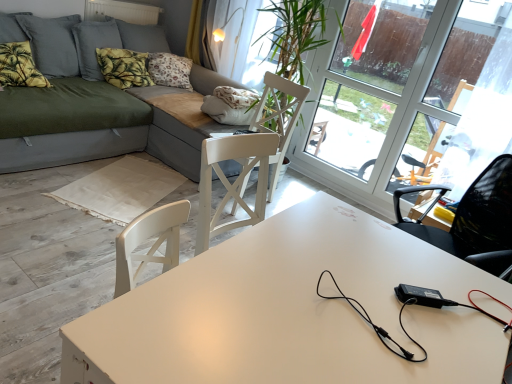
Measure the distance between yellow-green fabric pillow at upper left, the 1th pillow from the left, and camera.

yellow-green fabric pillow at upper left, the 1th pillow from the left, is 9.35 feet from camera.

Describe the element at coordinates (278, 118) in the screenshot. I see `white wood swivel chair at center` at that location.

Describe the element at coordinates (293, 311) in the screenshot. I see `white matte table at center` at that location.

The height and width of the screenshot is (384, 512). What do you see at coordinates (201, 34) in the screenshot?
I see `yellow fabric curtain at upper center` at bounding box center [201, 34].

Image resolution: width=512 pixels, height=384 pixels. Identify the location of yellow-green fabric pillow at upper left, the 1th pillow from the left. (19, 66).

Which object is further away from the camera, white wood swivel chair at center or white matte table at center?

white wood swivel chair at center is further away from the camera.

Does white wood swivel chair at center have a lesser height compared to white matte table at center?

No.

Based on the photo, is white wood swivel chair at center facing away from white matte table at center?

No, white wood swivel chair at center's orientation is not away from white matte table at center.

What's the angular difference between white wood swivel chair at center and white matte table at center's facing directions?

The angle between the facing direction of white wood swivel chair at center and the facing direction of white matte table at center is 82 degrees.

In the scene shown: Who is smaller, green leafy fabric pillow at upper left, placed as the first pillow when sorted from back to front, or matte gray couch at center?

green leafy fabric pillow at upper left, placed as the first pillow when sorted from back to front.

From a real-world perspective, is green leafy fabric pillow at upper left, placed as the first pillow when sorted from back to front, over matte gray couch at center?

Correct, in the physical world, green leafy fabric pillow at upper left, placed as the first pillow when sorted from back to front, is higher than matte gray couch at center.

How different are the orientations of green leafy fabric pillow at upper left, acting as the second pillow starting from the front, and matte gray couch at center in degrees?

The angle between the facing direction of green leafy fabric pillow at upper left, acting as the second pillow starting from the front, and the facing direction of matte gray couch at center is 4.48 degrees.

Is green leafy fabric pillow at upper left, the first pillow when ordered from right to left, not close to matte gray couch at center?

No, green leafy fabric pillow at upper left, the first pillow when ordered from right to left, is not far from matte gray couch at center.

From the image's perspective, between white matte table at center and yellow-green fabric pillow at upper left, which is counted as the 1th pillow, starting from the front, who is located below?

white matte table at center, from the image's perspective.

Is white matte table at center looking in the opposite direction of yellow-green fabric pillow at upper left, which is counted as the 1th pillow, starting from the front?

No, white matte table at center is not facing the opposite direction of yellow-green fabric pillow at upper left, which is counted as the 1th pillow, starting from the front.

From a real-world perspective, who is located lower, white matte table at center or yellow-green fabric pillow at upper left, the 1th pillow from the left?

In real-world perspective, white matte table at center is lower.

Which of these two, white matte table at center or yellow-green fabric pillow at upper left, positioned as the 2th pillow in right-to-left order, is bigger?

white matte table at center.

Is matte gray couch at center to the left or to the right of yellow fabric curtain at upper center in the image?

From the image, it's evident that matte gray couch at center is to the left of yellow fabric curtain at upper center.

Considering the positions of objects matte gray couch at center and yellow fabric curtain at upper center in the image provided, who is behind, matte gray couch at center or yellow fabric curtain at upper center?

yellow fabric curtain at upper center is more distant.

This screenshot has height=384, width=512. In order to click on curtain located on the right of matte gray couch at center in this screenshot , I will do `click(201, 34)`.

Based on the photo, is matte gray couch at center in front of or behind white matte table at center in the image?

In the image, matte gray couch at center appears behind white matte table at center.

Which is closer, (225, 164) or (350, 290)?

The point (350, 290) is closer.

This screenshot has width=512, height=384. Identify the location of studio couch lying behind the white matte table at center. (96, 127).

Who is smaller, matte gray couch at center or white matte table at center?

With smaller size is white matte table at center.

Between white matte table at center and green leafy fabric pillow at upper left, the first pillow when ordered from right to left, which one has more height?

With more height is white matte table at center.

The height and width of the screenshot is (384, 512). Find the location of `the 2nd pillow behind the white matte table at center`. the 2nd pillow behind the white matte table at center is located at coordinates pyautogui.click(x=123, y=67).

Can you confirm if white matte table at center is smaller than green leafy fabric pillow at upper left, placed as the first pillow when sorted from back to front?

Incorrect, white matte table at center is not smaller in size than green leafy fabric pillow at upper left, placed as the first pillow when sorted from back to front.

Is point (247, 318) positioned in front of point (153, 83)?

Yes, it is.

Which is correct: transparent glass window at upper right is inside yellow fabric curtain at upper center, or outside of it?

transparent glass window at upper right is not enclosed by yellow fabric curtain at upper center.

Who is smaller, transparent glass window at upper right or yellow fabric curtain at upper center?

With smaller size is yellow fabric curtain at upper center.

Is transparent glass window at upper right wider or thinner than yellow fabric curtain at upper center?

Clearly, transparent glass window at upper right has less width compared to yellow fabric curtain at upper center.

The width and height of the screenshot is (512, 384). I want to click on curtain to the left of transparent glass window at upper right, so click(x=201, y=34).

Find the location of `table below the white wood swivel chair at center (from a real-world perspective)`. table below the white wood swivel chair at center (from a real-world perspective) is located at coordinates (293, 311).

Find the location of `studio couch that is below the green leafy fabric pillow at upper left, which is the second pillow from left to right (from the image's perspective)`. studio couch that is below the green leafy fabric pillow at upper left, which is the second pillow from left to right (from the image's perspective) is located at coordinates (96, 127).

Looking at the image, which one is located closer to transparent glass window at upper right, white wood swivel chair at center or yellow-green fabric pillow at upper left, the 1th pillow from the left?

Among the two, white wood swivel chair at center is located nearer to transparent glass window at upper right.

Which object lies further to the anchor point green leafy fabric pillow at upper left, which is the second pillow from left to right, yellow fabric curtain at upper center or white matte table at center?

white matte table at center is further to green leafy fabric pillow at upper left, which is the second pillow from left to right.

In the scene shown: From the image, which object appears to be farther from green leafy fabric pillow at upper left, acting as the second pillow starting from the front, matte gray couch at center or white wood swivel chair at center?

white wood swivel chair at center.

Considering their positions, is yellow-green fabric pillow at upper left, which is counted as the 1th pillow, starting from the front, positioned further to matte gray couch at center than transparent glass window at upper right?

transparent glass window at upper right is further to matte gray couch at center.

Looking at the image, which one is located further to transparent glass window at upper right, matte gray couch at center or white matte table at center?

white matte table at center.

In the scene shown: Looking at the image, which one is located further to transparent glass window at upper right, white wood swivel chair at center or green leafy fabric pillow at upper left, acting as the second pillow starting from the front?

green leafy fabric pillow at upper left, acting as the second pillow starting from the front, is positioned further to the anchor transparent glass window at upper right.

Looking at the image, which one is located further to white wood swivel chair at center, yellow fabric curtain at upper center or yellow-green fabric pillow at upper left, positioned as the 2th pillow in right-to-left order?

The object further to white wood swivel chair at center is yellow-green fabric pillow at upper left, positioned as the 2th pillow in right-to-left order.

Estimate the real-world distances between objects in this image. Which object is further from transparent glass window at upper right, white matte table at center or white wood swivel chair at center?

white matte table at center.

Find the location of a particular element. Image resolution: width=512 pixels, height=384 pixels. swivel chair between green leafy fabric pillow at upper left, the first pillow when ordered from right to left, and transparent glass window at upper right, in the horizontal direction is located at coordinates (278, 118).

Where is `studio couch located between white matte table at center and white wood swivel chair at center in the depth direction`? The height and width of the screenshot is (384, 512). studio couch located between white matte table at center and white wood swivel chair at center in the depth direction is located at coordinates (96, 127).

Where is `studio couch between white matte table at center and transparent glass window at upper right along the z-axis`? The image size is (512, 384). studio couch between white matte table at center and transparent glass window at upper right along the z-axis is located at coordinates (96, 127).

I want to click on window between white matte table at center and green leafy fabric pillow at upper left, placed as the first pillow when sorted from back to front, from front to back, so click(410, 98).